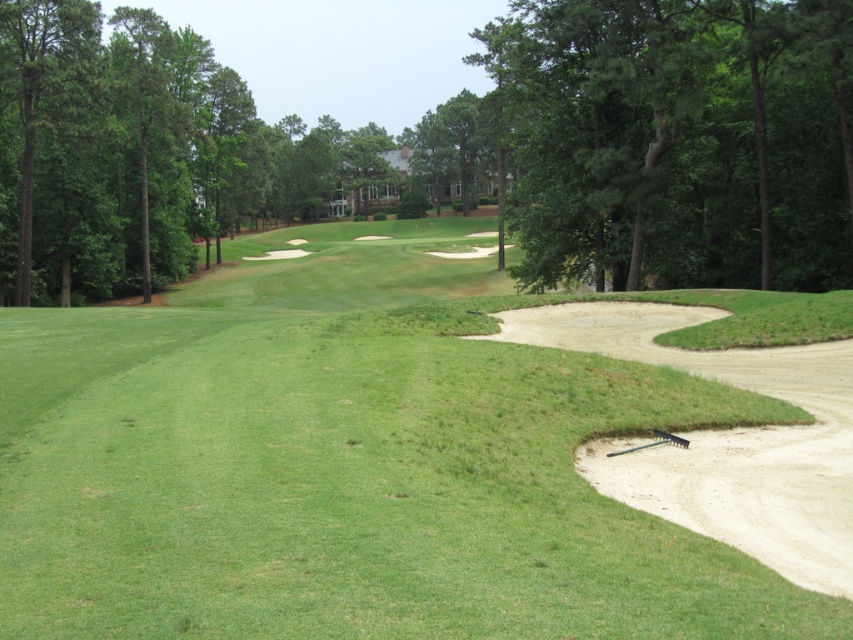
Between point (228, 275) and point (724, 86), which one is positioned behind?

The point (228, 275) is behind.

Who is more distant from viewer, [293,493] or [833,218]?

The point [833,218] is more distant.

At what (x,y) coordinates should I click in order to perform the action: click on green grassy golf course at center. Please return your answer as a coordinate pair (x, y). Looking at the image, I should click on (349, 465).

Between green leafy tree at center and green leafy tree at upper center, which one has less height?

Standing shorter between the two is green leafy tree at upper center.

Does green leafy tree at center appear on the right side of green leafy tree at upper center?

No, green leafy tree at center is not to the right of green leafy tree at upper center.

Between point (45, 40) and point (527, 65), which one is positioned in front?

Point (527, 65)

Image resolution: width=853 pixels, height=640 pixels. Find the location of `green leafy tree at center`. green leafy tree at center is located at coordinates (445, 147).

Where is `green grassy golf course at center`? This screenshot has height=640, width=853. green grassy golf course at center is located at coordinates (349, 465).

Who is higher up, green grassy golf course at center or green leafy tree at upper center?

green leafy tree at upper center is above.

Describe the element at coordinates (349, 465) in the screenshot. I see `green grassy golf course at center` at that location.

Where is `green grassy golf course at center`? The image size is (853, 640). green grassy golf course at center is located at coordinates (349, 465).